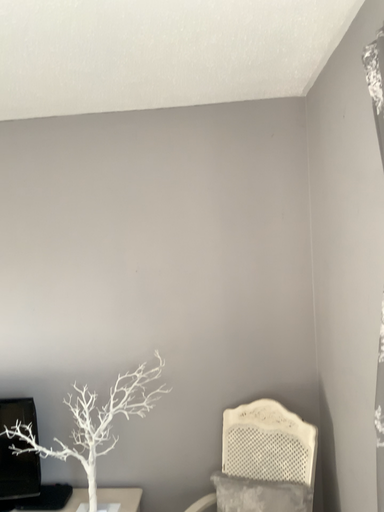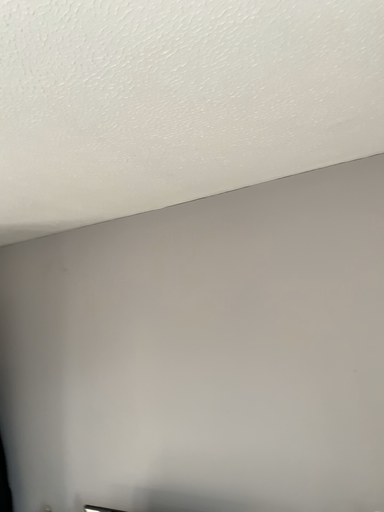
Question: Which way did the camera rotate in the video?

Choices:
 (A) rotated right
 (B) rotated left

Answer: (B)